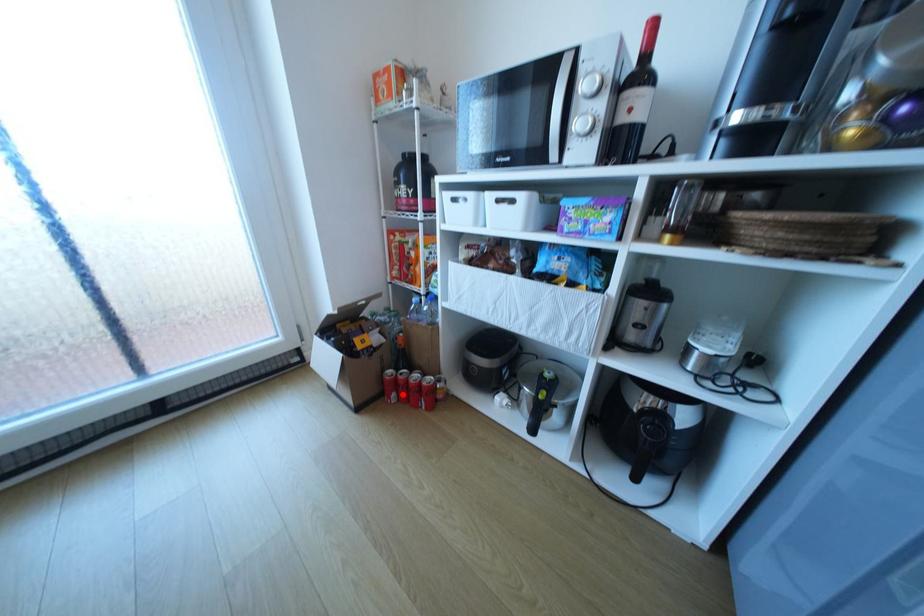
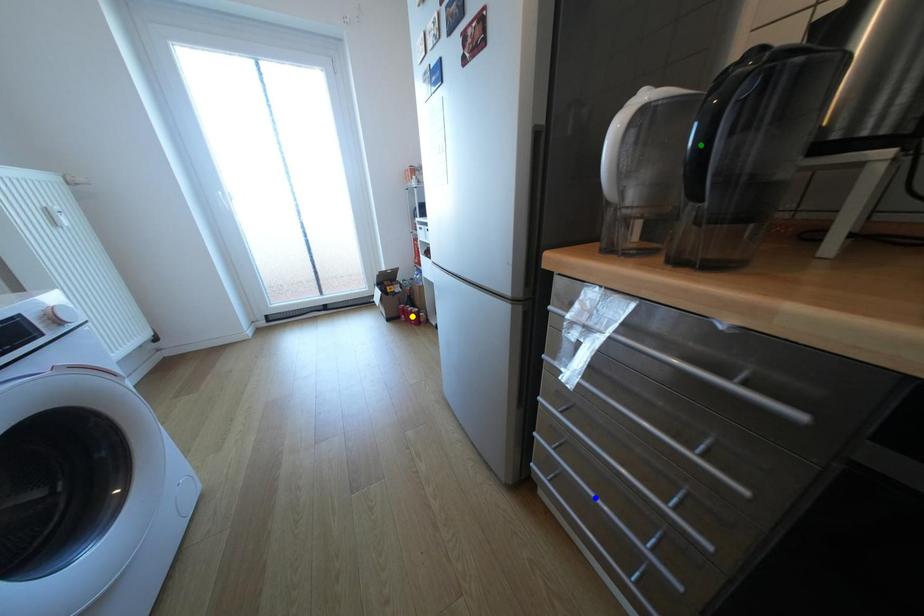
Question: I am providing you with two images of the same scene from different viewpoints. A red point is marked on the first image. You are given multiple points on the second image. Which point in image 2 is actually the same real-world point as the red point in image 1?

Choices:
 (A) blue point
 (B) yellow point
 (C) green point

Answer: (B)